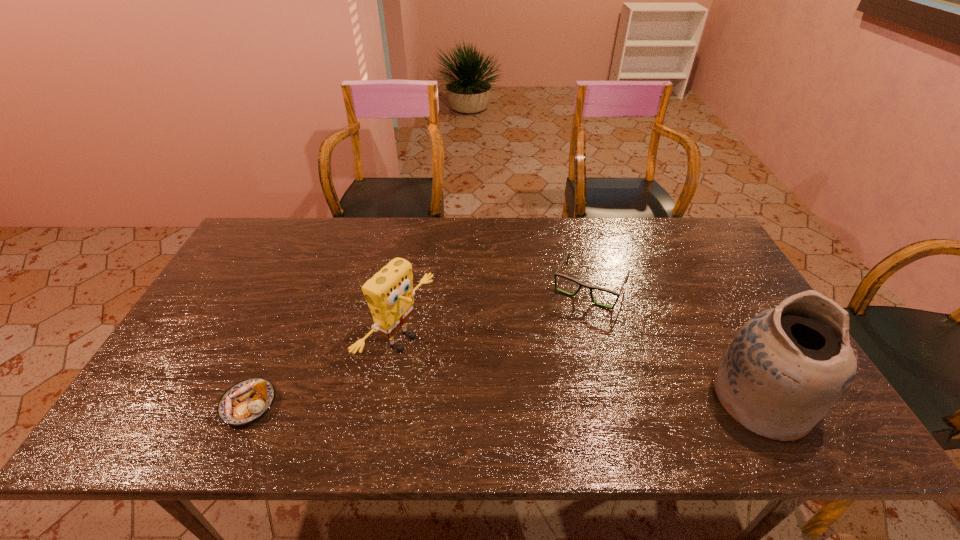
Where is `vacant space on the desktop that is between the leftmost object and the tallest object and is positioned on the lens of the second shortest object`? Image resolution: width=960 pixels, height=540 pixels. vacant space on the desktop that is between the leftmost object and the tallest object and is positioned on the lens of the second shortest object is located at coordinates (532, 402).

You are a GUI agent. You are given a task and a screenshot of the screen. Output one action in this format:
    pyautogui.click(x=<x>, y=<y>)
    Task: Click on the free space on the desktop that is between the pastry and the tallest object and is positioned on the face of the sponge
    The height and width of the screenshot is (540, 960).
    Given the screenshot: What is the action you would take?
    pyautogui.click(x=521, y=402)